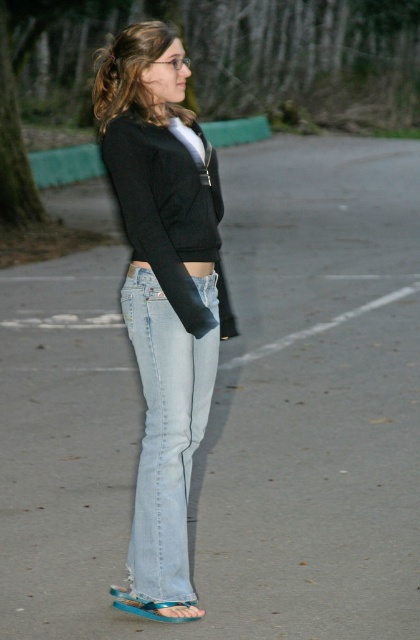
This screenshot has width=420, height=640. Find the location of `light blue denim jeans at lower center`. light blue denim jeans at lower center is located at coordinates pyautogui.click(x=167, y=429).

Can you confirm if light blue denim jeans at lower center is thinner than blue rubber sandal at lower center?

No, light blue denim jeans at lower center is not thinner than blue rubber sandal at lower center.

Between point (188, 408) and point (120, 600), which one is positioned in front?

Point (188, 408) is in front.

Where is `light blue denim jeans at lower center`? This screenshot has height=640, width=420. light blue denim jeans at lower center is located at coordinates (167, 429).

Does light blue denim jeans at lower center have a lesser width compared to black matte sweater at center?

Yes.

Does light blue denim jeans at lower center appear on the left side of black matte sweater at center?

Yes, light blue denim jeans at lower center is to the left of black matte sweater at center.

Between point (134, 545) and point (215, 208), which one is positioned in front?

Point (134, 545) is in front.

Where is `light blue denim jeans at lower center`? This screenshot has width=420, height=640. light blue denim jeans at lower center is located at coordinates (167, 429).

Looking at this image, which is above, black matte sweater at center or blue rubber sandal at lower center?

black matte sweater at center

Which of these two, black matte sweater at center or blue rubber sandal at lower center, stands shorter?

Standing shorter between the two is blue rubber sandal at lower center.

Find the location of a particular element. This screenshot has width=420, height=640. black matte sweater at center is located at coordinates click(168, 212).